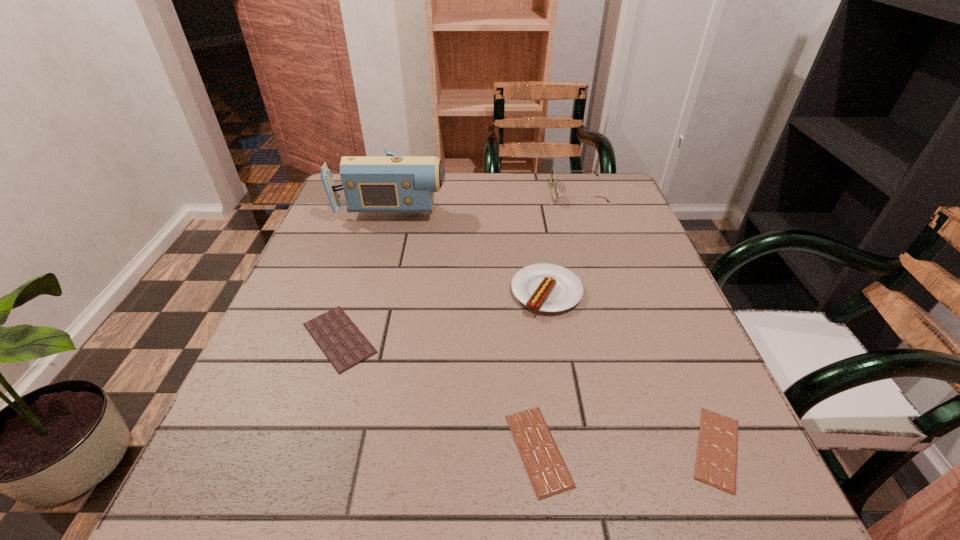
Where is `camcorder`? camcorder is located at coordinates (393, 183).

The width and height of the screenshot is (960, 540). In order to click on the second tallest object in this screenshot , I will do `click(552, 171)`.

Identify the location of the third tallest object. The width and height of the screenshot is (960, 540). (545, 287).

Where is `the leftmost chocolate bar`? This screenshot has height=540, width=960. the leftmost chocolate bar is located at coordinates (344, 345).

Locate an element on the screen. This screenshot has height=540, width=960. the fourth tallest object is located at coordinates (344, 345).

This screenshot has height=540, width=960. In order to click on the second chocolate bar from right to left in this screenshot , I will do `click(549, 475)`.

You are a GUI agent. You are given a task and a screenshot of the screen. Output one action in this format:
    pyautogui.click(x=<x>, y=<y>)
    Task: Click on the rightmost chocolate bar
    The width and height of the screenshot is (960, 540).
    Given the screenshot: What is the action you would take?
    pyautogui.click(x=716, y=462)

Image resolution: width=960 pixels, height=540 pixels. In order to click on vacant area situated 0.130m on the side of the tallest object with the flip-out screen in this screenshot , I will do `click(497, 201)`.

You are a GUI agent. You are given a task and a screenshot of the screen. Output one action in this format:
    pyautogui.click(x=<x>, y=<y>)
    Task: Click on the vacant area located 0.090m on the front-facing side of the fifth shortest object
    This screenshot has width=960, height=540.
    Given the screenshot: What is the action you would take?
    pyautogui.click(x=520, y=193)

The height and width of the screenshot is (540, 960). In order to click on vacant space situated on the front-facing side of the fifth shortest object in this screenshot , I will do `click(452, 193)`.